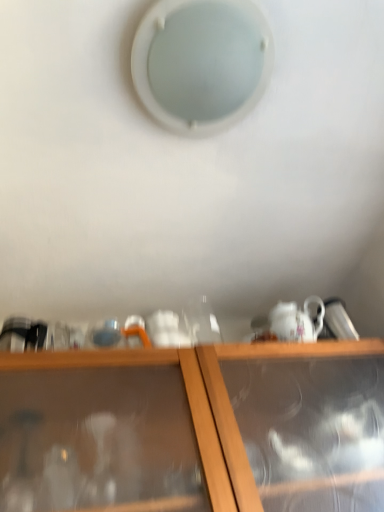
Question: Is wooden cabinet at lower center shorter than white frosted glass hole at upper center?

Choices:
 (A) no
 (B) yes

Answer: (A)

Question: Does wooden cabinet at lower center have a lesser width compared to white frosted glass hole at upper center?

Choices:
 (A) yes
 (B) no

Answer: (B)

Question: From the image's perspective, is wooden cabinet at lower center below white frosted glass hole at upper center?

Choices:
 (A) yes
 (B) no

Answer: (A)

Question: From the image's perspective, is wooden cabinet at lower center above white frosted glass hole at upper center?

Choices:
 (A) yes
 (B) no

Answer: (B)

Question: Does wooden cabinet at lower center have a larger size compared to white frosted glass hole at upper center?

Choices:
 (A) yes
 (B) no

Answer: (A)

Question: Are wooden cabinet at lower center and white frosted glass hole at upper center beside each other?

Choices:
 (A) yes
 (B) no

Answer: (B)

Question: Can you confirm if white frosted glass hole at upper center is smaller than wooden cabinet at lower center?

Choices:
 (A) no
 (B) yes

Answer: (B)

Question: Is white frosted glass hole at upper center completely or partially outside of wooden cabinet at lower center?

Choices:
 (A) yes
 (B) no

Answer: (A)

Question: Could you tell me if white frosted glass hole at upper center is facing wooden cabinet at lower center?

Choices:
 (A) yes
 (B) no

Answer: (B)

Question: Does white frosted glass hole at upper center have a lesser width compared to wooden cabinet at lower center?

Choices:
 (A) no
 (B) yes

Answer: (B)

Question: Is white frosted glass hole at upper center closer to the viewer compared to wooden cabinet at lower center?

Choices:
 (A) no
 (B) yes

Answer: (A)

Question: Does white frosted glass hole at upper center have a lesser height compared to wooden cabinet at lower center?

Choices:
 (A) yes
 (B) no

Answer: (A)

Question: Would you say wooden cabinet at lower center is inside or outside white frosted glass hole at upper center?

Choices:
 (A) inside
 (B) outside

Answer: (B)